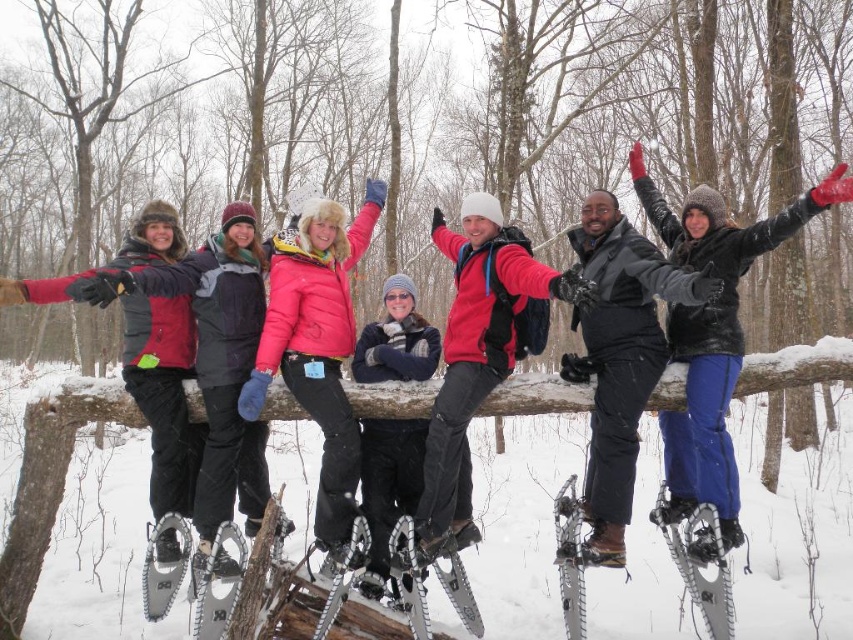
You are standing at point (74, 528) in the snowy forest. What do you see directly in front of you?

You see white fluffy snow at center directly in front of you at point (74, 528).

You are planning to take a photo of the group in the snowy scene. The white fluffy snow at center and the black woolen scarf at center are both in the frame. Which object occupies more horizontal space in the photo?

The white fluffy snow at center might be wider than black woolen scarf at center according to the description, so it likely occupies more horizontal space in the photo.

You are planning to take a photo of the group in the snowy forest. Since the white fluffy snow at center and the pink matte jacket at center are both in the frame, which one will occupy more horizontal space in the photo?

The white fluffy snow at center occupies more horizontal space in the photo because its width is larger than that of the pink matte jacket at center.